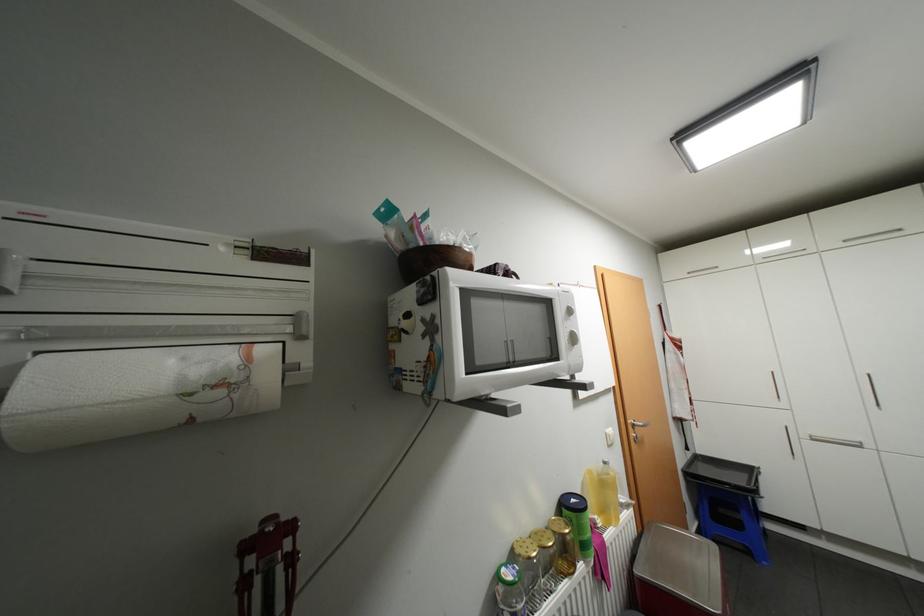
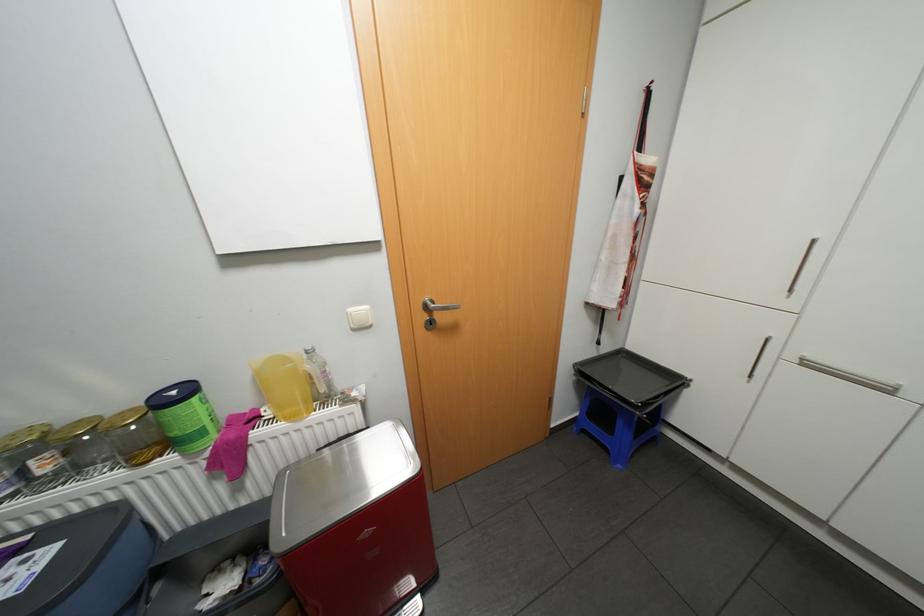
The point at (821, 438) is marked in the first image. Where is the corresponding point in the second image?

(813, 363)